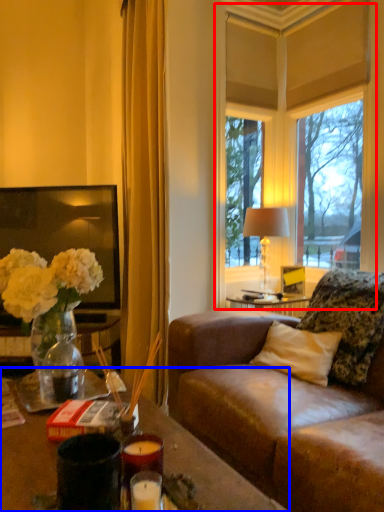
Question: Which of the following is the closest to the observer, window (highlighted by a red box) or desk (highlighted by a blue box)?

Choices:
 (A) window
 (B) desk

Answer: (B)